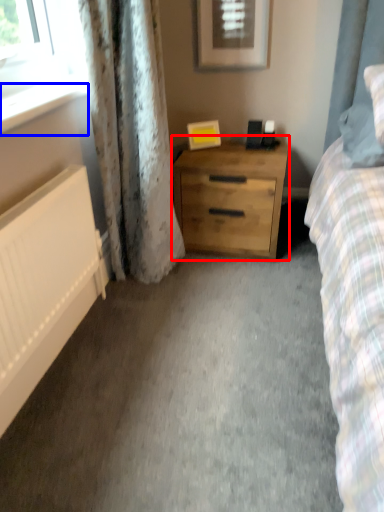
Question: Which object is further to the camera taking this photo, chest of drawers (highlighted by a red box) or window sill (highlighted by a blue box)?

Choices:
 (A) chest of drawers
 (B) window sill

Answer: (A)